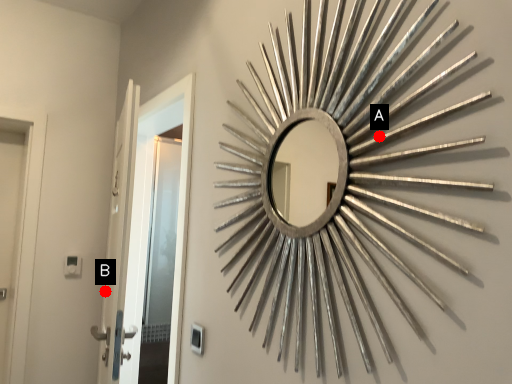
Question: Two points are circled on the image, labeled by A and B beside each circle. Which point is farther to the camera?

Choices:
 (A) A is further
 (B) B is further

Answer: (B)